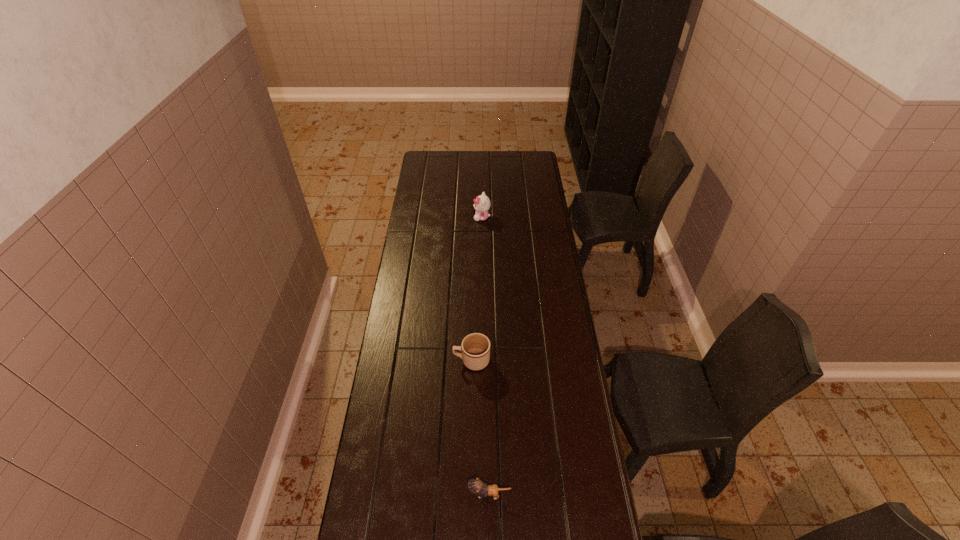
Locate an element on the screen. free location located on the side of the second shortest object with the handle is located at coordinates (396, 361).

At what (x,y) coordinates should I click in order to perform the action: click on free space located on the side of the second shortest object with the handle. Please return your answer as a coordinate pair (x, y). The height and width of the screenshot is (540, 960). Looking at the image, I should click on (432, 361).

You are a GUI agent. You are given a task and a screenshot of the screen. Output one action in this format:
    pyautogui.click(x=<x>, y=<y>)
    Task: Click on the vacant space located 0.190m on the front-facing side of the shortest object
    The width and height of the screenshot is (960, 540).
    Given the screenshot: What is the action you would take?
    pyautogui.click(x=406, y=494)

Identify the location of free spot located 0.110m on the front-facing side of the shortest object. The image size is (960, 540). (432, 494).

Find the location of a particular element. free point located 0.310m on the front-facing side of the shortest object is located at coordinates (367, 494).

The width and height of the screenshot is (960, 540). I want to click on free space at the far edge of the desktop, so click(x=501, y=165).

Where is `vacant space at the left edge of the desktop`? vacant space at the left edge of the desktop is located at coordinates (405, 277).

Locate an element on the screen. The width and height of the screenshot is (960, 540). vacant space at the right edge of the desktop is located at coordinates (551, 340).

This screenshot has width=960, height=540. I want to click on vacant region at the far left corner of the desktop, so click(421, 165).

Locate an element on the screen. This screenshot has width=960, height=540. free space that is in between the mug and the farthest object is located at coordinates (477, 289).